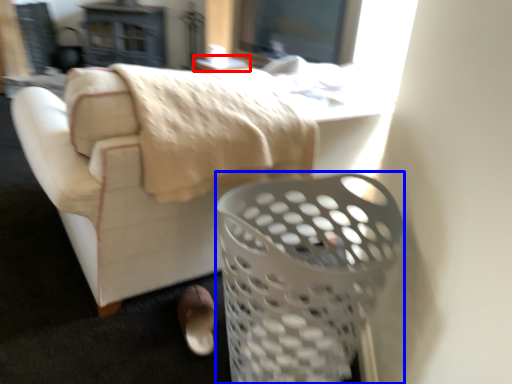
Question: Among these objects, which one is nearest to the camera, table (highlighted by a red box) or basket (highlighted by a blue box)?

Choices:
 (A) table
 (B) basket

Answer: (B)